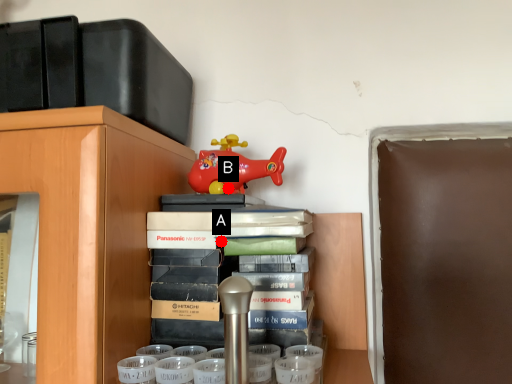
Question: Two points are circled on the image, labeled by A and B beside each circle. Which point appears closest to the camera in this image?

Choices:
 (A) A is closer
 (B) B is closer

Answer: (A)